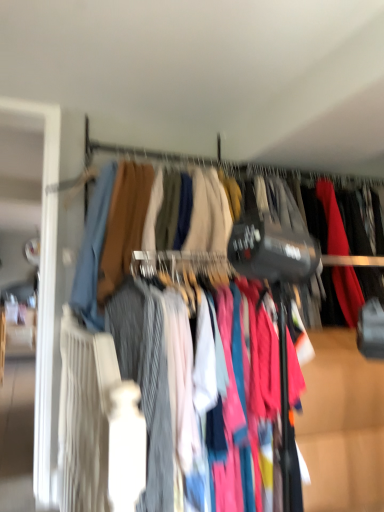
Question: Considering the relative positions of striped cotton pants at center and matte fabric dress at center in the image provided, is striped cotton pants at center in front of matte fabric dress at center?

Choices:
 (A) yes
 (B) no

Answer: (A)

Question: Is striped cotton pants at center at the right side of matte fabric dress at center?

Choices:
 (A) yes
 (B) no

Answer: (A)

Question: Is matte fabric dress at center completely or partially inside striped cotton pants at center?

Choices:
 (A) no
 (B) yes

Answer: (B)

Question: Does striped cotton pants at center appear on the left side of matte fabric dress at center?

Choices:
 (A) yes
 (B) no

Answer: (B)

Question: From the image's perspective, is striped cotton pants at center above matte fabric dress at center?

Choices:
 (A) yes
 (B) no

Answer: (B)

Question: Considering the relative positions of textured fabric clothes at center and matte fabric dress at center in the image provided, is textured fabric clothes at center to the left or to the right of matte fabric dress at center?

Choices:
 (A) left
 (B) right

Answer: (A)

Question: Is point (299, 242) positioned closer to the camera than point (163, 505)?

Choices:
 (A) farther
 (B) closer

Answer: (B)

Question: Is textured fabric clothes at center inside the boundaries of matte fabric dress at center, or outside?

Choices:
 (A) inside
 (B) outside

Answer: (B)

Question: Is textured fabric clothes at center bigger or smaller than matte fabric dress at center?

Choices:
 (A) small
 (B) big

Answer: (B)

Question: From the image's perspective, is matte fabric dress at center above or below textured fabric clothes at center?

Choices:
 (A) above
 (B) below

Answer: (B)

Question: Considering the positions of matte fabric dress at center and textured fabric clothes at center in the image, is matte fabric dress at center taller or shorter than textured fabric clothes at center?

Choices:
 (A) tall
 (B) short

Answer: (A)

Question: Considering the positions of matte fabric dress at center and textured fabric clothes at center in the image, is matte fabric dress at center wider or thinner than textured fabric clothes at center?

Choices:
 (A) thin
 (B) wide

Answer: (B)

Question: Considering the relative positions of matte fabric dress at center and textured fabric clothes at center in the image provided, is matte fabric dress at center to the left or to the right of textured fabric clothes at center?

Choices:
 (A) left
 (B) right

Answer: (B)

Question: In terms of height, does striped cotton pants at center look taller or shorter compared to matte fabric dress at center?

Choices:
 (A) short
 (B) tall

Answer: (B)

Question: Looking at their shapes, would you say striped cotton pants at center is wider or thinner than matte fabric dress at center?

Choices:
 (A) thin
 (B) wide

Answer: (A)